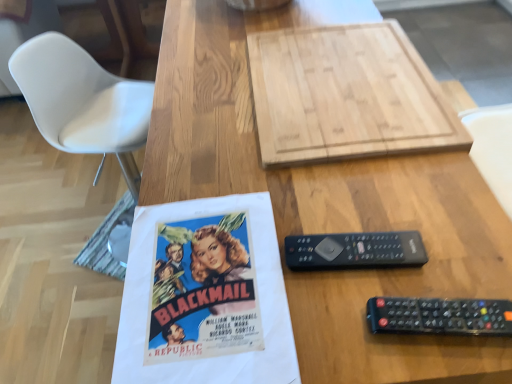
You are a GUI agent. You are given a task and a screenshot of the screen. Output one action in this format:
    pyautogui.click(x=<x>, y=<y>)
    Task: Click on the vacant area situated to the left side of natural wood cutting board at upper center
    This screenshot has height=384, width=512.
    Given the screenshot: What is the action you would take?
    pyautogui.click(x=205, y=103)